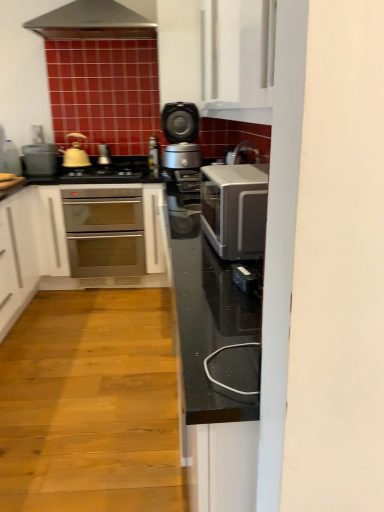
Question: Considering the relative sizes of satin silver cooker at center and matte yellow tea pot at left in the image provided, is satin silver cooker at center shorter than matte yellow tea pot at left?

Choices:
 (A) no
 (B) yes

Answer: (A)

Question: Is satin silver cooker at center to the left of matte yellow tea pot at left from the viewer's perspective?

Choices:
 (A) no
 (B) yes

Answer: (A)

Question: Is satin silver cooker at center not inside matte yellow tea pot at left?

Choices:
 (A) yes
 (B) no

Answer: (A)

Question: Does satin silver cooker at center have a greater width compared to matte yellow tea pot at left?

Choices:
 (A) yes
 (B) no

Answer: (A)

Question: Could you tell me if satin silver cooker at center is facing matte yellow tea pot at left?

Choices:
 (A) yes
 (B) no

Answer: (B)

Question: In terms of width, does matte yellow tea pot at left look wider or thinner when compared to matte silver toaster at left, which is the first appliance from left to right?

Choices:
 (A) wide
 (B) thin

Answer: (B)

Question: Which is correct: matte yellow tea pot at left is inside matte silver toaster at left, which is the first appliance from left to right, or outside of it?

Choices:
 (A) inside
 (B) outside

Answer: (B)

Question: Is matte yellow tea pot at left in front of or behind matte silver toaster at left, which appears as the 2th appliance when viewed from the right, in the image?

Choices:
 (A) behind
 (B) front

Answer: (A)

Question: From the image's perspective, is matte yellow tea pot at left positioned above or below matte silver toaster at left, which is the first appliance from left to right?

Choices:
 (A) below
 (B) above

Answer: (B)

Question: Is satin silver cooker at center wider or thinner than stainless steel oven at center?

Choices:
 (A) thin
 (B) wide

Answer: (A)

Question: Is satin silver cooker at center taller or shorter than stainless steel oven at center?

Choices:
 (A) tall
 (B) short

Answer: (B)

Question: From a real-world perspective, is satin silver cooker at center physically located above or below stainless steel oven at center?

Choices:
 (A) above
 (B) below

Answer: (A)

Question: Considering the relative positions of satin silver cooker at center and stainless steel oven at center in the image provided, is satin silver cooker at center to the left or to the right of stainless steel oven at center?

Choices:
 (A) left
 (B) right

Answer: (B)

Question: Is point (48, 148) closer or farther from the camera than point (259, 250)?

Choices:
 (A) farther
 (B) closer

Answer: (A)

Question: Considering the relative positions of matte silver toaster at left, which is the first appliance from left to right, and satin silver toaster oven at center in the image provided, is matte silver toaster at left, which is the first appliance from left to right, to the left or to the right of satin silver toaster oven at center?

Choices:
 (A) right
 (B) left

Answer: (B)